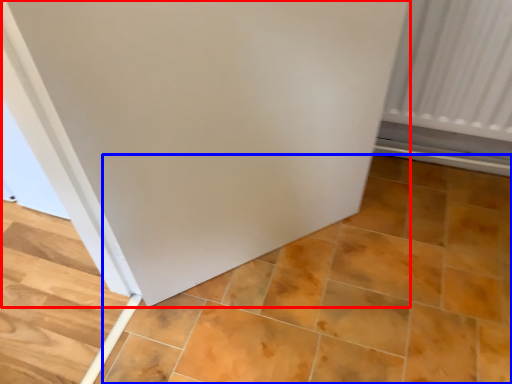
Question: Which object is further to the camera taking this photo, door (highlighted by a red box) or ceramic tile (highlighted by a blue box)?

Choices:
 (A) door
 (B) ceramic tile

Answer: (B)